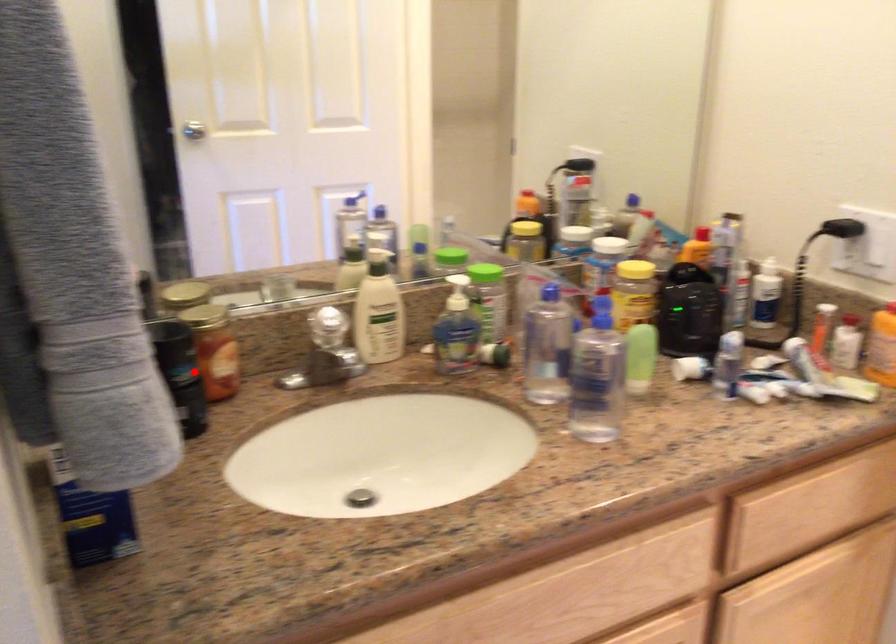
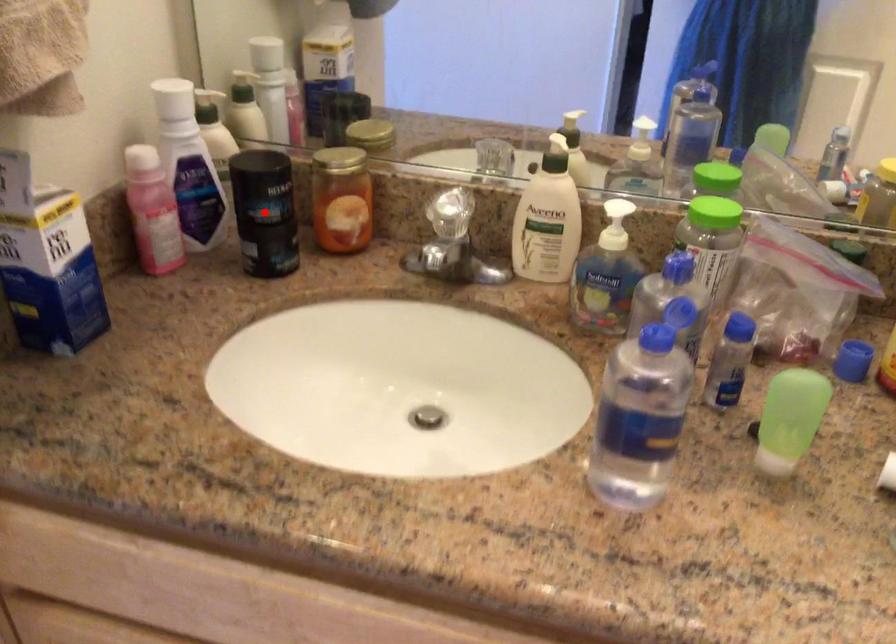
I am providing you with two images of the same scene from different viewpoints. A red point is marked on the first image and another point is marked on the second image. Are the points marked in image1 and image2 representing the same 3D position?

Yes